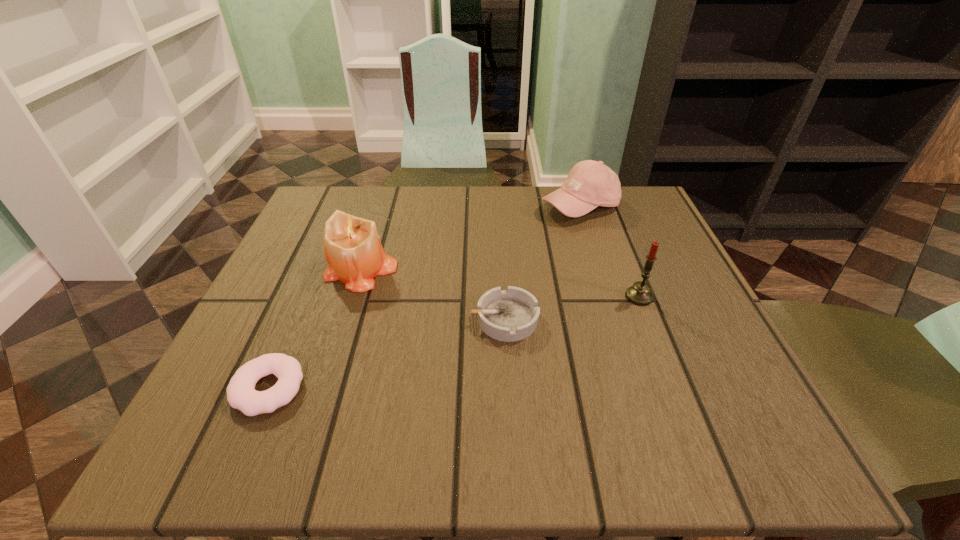
Image resolution: width=960 pixels, height=540 pixels. I want to click on vacant space located 0.070m on the front-facing side of the farthest object, so point(593,245).

This screenshot has height=540, width=960. I want to click on vacant space located on the left of the second shortest object, so click(x=342, y=319).

Identify the location of free region located 0.220m on the back of the nearest object. (318, 273).

At what (x,y) coordinates should I click in order to perform the action: click on object located at the far edge. Please return your answer as a coordinate pair (x, y). Looking at the image, I should click on (590, 184).

Find the location of `object located at the near edge`. object located at the near edge is located at coordinates (241, 394).

The height and width of the screenshot is (540, 960). What are the coordinates of `candle present at the left edge` in the screenshot? It's located at (352, 247).

Locate an element on the screen. The image size is (960, 540). doughnut that is at the left edge is located at coordinates 241,394.

Locate an element on the screen. candle located at the right edge is located at coordinates (640, 293).

At what (x,y) coordinates should I click in order to perform the action: click on baseball cap at the right edge. Please return your answer as a coordinate pair (x, y). The width and height of the screenshot is (960, 540). Looking at the image, I should click on (590, 184).

Where is `object positioned at the near left corner`? object positioned at the near left corner is located at coordinates (241, 394).